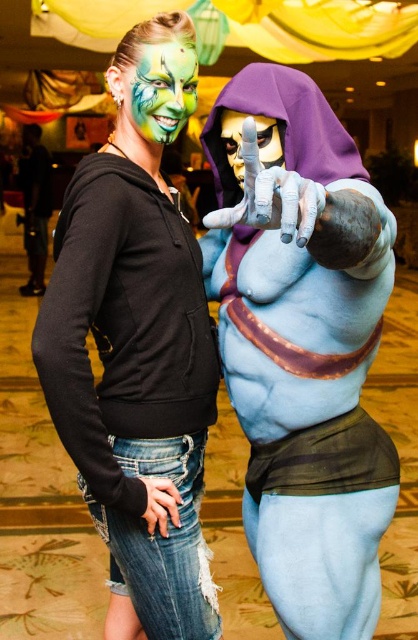
You are a photographer at a costume event. You need to capture a closeup shot of the gold metallic mask at center without the black matte hoodie at center appearing in the background. Given that your camera has a depth of field that can blur objects beyond 18 inches away, can you achieve this?

The distance between the black matte hoodie at center and the gold metallic mask at center is 19.18 inches. Since the depth of field blurs objects beyond 18 inches away, the black matte hoodie at center will be slightly out of focus but may still partially visible. To fully exclude it, you might need to increase the distance further or use a different camera setting.